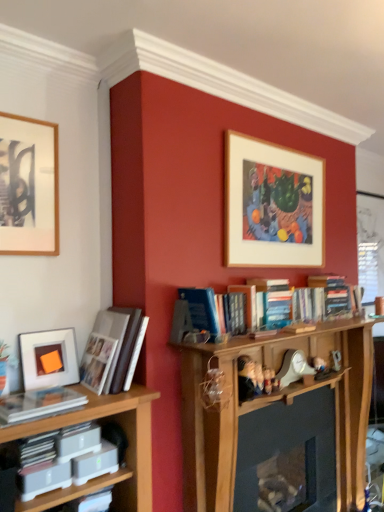
Question: Is wooden picture frame at upper left, acting as the 3th picture frame starting from the right, wider than clear plastic book at lower left, which is counted as the second book, starting from the top?

Choices:
 (A) no
 (B) yes

Answer: (A)

Question: Can you confirm if wooden picture frame at upper left, acting as the 3th picture frame starting from the right, is bigger than clear plastic book at lower left, the first book from the bottom?

Choices:
 (A) no
 (B) yes

Answer: (B)

Question: Is wooden picture frame at upper left, positioned as the 1th picture frame in left-to-right order, next to clear plastic book at lower left, arranged as the second book when viewed from the back, and touching it?

Choices:
 (A) yes
 (B) no

Answer: (B)

Question: From the image's perspective, is wooden picture frame at upper left, positioned as the 1th picture frame in left-to-right order, above clear plastic book at lower left, the first book from the bottom?

Choices:
 (A) yes
 (B) no

Answer: (A)

Question: Is wooden picture frame at upper left, which appears as the 2th picture frame when viewed from the front, completely or partially outside of clear plastic book at lower left, the first book from the bottom?

Choices:
 (A) yes
 (B) no

Answer: (A)

Question: Does wooden picture frame at upper left, which is the 2th picture frame from back to front, lie in front of clear plastic book at lower left, which is counted as the second book, starting from the top?

Choices:
 (A) no
 (B) yes

Answer: (A)

Question: Can you confirm if matte white picture frame at left, acting as the 3th picture frame starting from the back, is taller than matte white paperback book at lower left?

Choices:
 (A) no
 (B) yes

Answer: (B)

Question: Is matte white picture frame at left, arranged as the 1th picture frame when viewed from the front, at the left side of matte white paperback book at lower left?

Choices:
 (A) no
 (B) yes

Answer: (B)

Question: Is matte white picture frame at left, which ranks as the 2th picture frame in right-to-left order, positioned in front of matte white paperback book at lower left?

Choices:
 (A) no
 (B) yes

Answer: (A)

Question: Is matte white paperback book at lower left surrounded by matte white picture frame at left, positioned as the 2th picture frame in left-to-right order?

Choices:
 (A) yes
 (B) no

Answer: (B)

Question: From the image's perspective, is matte white picture frame at left, acting as the 3th picture frame starting from the back, under matte white paperback book at lower left?

Choices:
 (A) no
 (B) yes

Answer: (A)

Question: Can you confirm if matte white picture frame at left, arranged as the 1th picture frame when viewed from the front, is wider than matte white paperback book at lower left?

Choices:
 (A) no
 (B) yes

Answer: (A)

Question: Is wooden picture frame at upper center, the 1th picture frame in the right-to-left sequence, smaller than matte white paperback book at lower left?

Choices:
 (A) no
 (B) yes

Answer: (A)